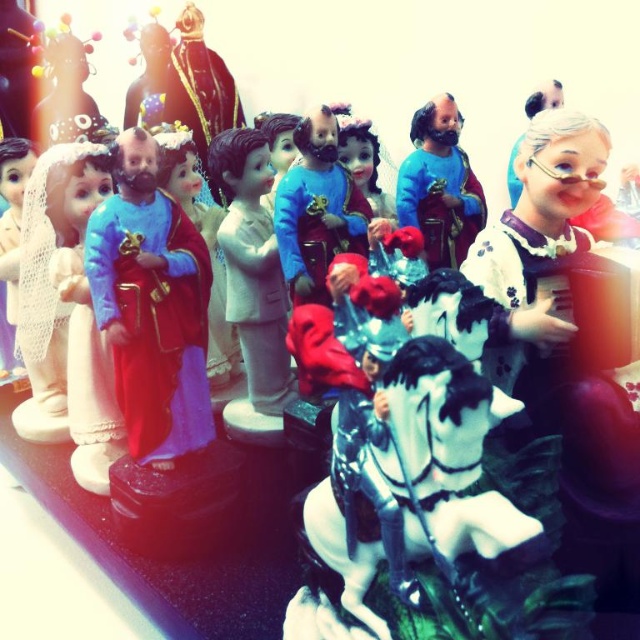
Consider the image. You are setting up a display and want to place the blue glossy statue at center and the matte black figurine at upper left. Given their sizes, which one should you place first to ensure stability?

The blue glossy statue at center has a smaller size compared to matte black figurine at upper left. Therefore, you should place the matte black figurine at upper left first, as larger items are typically placed first for stability, and the smaller blue glossy statue at center can be positioned on top or around it.

You are setting up a display and need to place the blue glossy statue at center and the matte black figurine at upper left. According to the scene, which figurine is on the right side of the other?

The blue glossy statue at center is positioned on the right side of the matte black figurine at upper left.

You are setting up a display and want to place a small decorative item between the matte plastic figurine at center and the blue glossy statue at center. Based on their positions, where should you place the item?

The matte plastic figurine at center is positioned under the blue glossy statue at center, so placing the item between them would require positioning it below the blue glossy statue at center and above the matte plastic figurine at center.